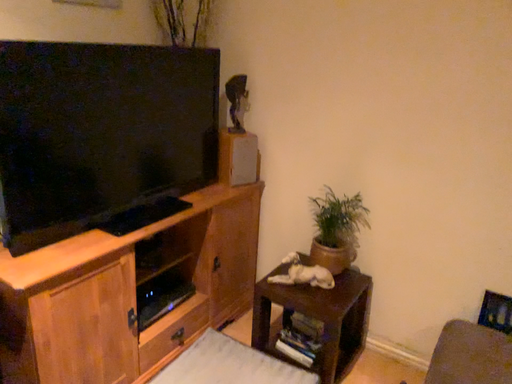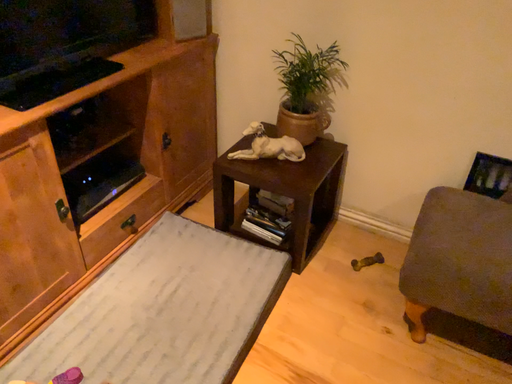
Question: Which way did the camera rotate in the video?

Choices:
 (A) rotated upward
 (B) rotated downward

Answer: (B)